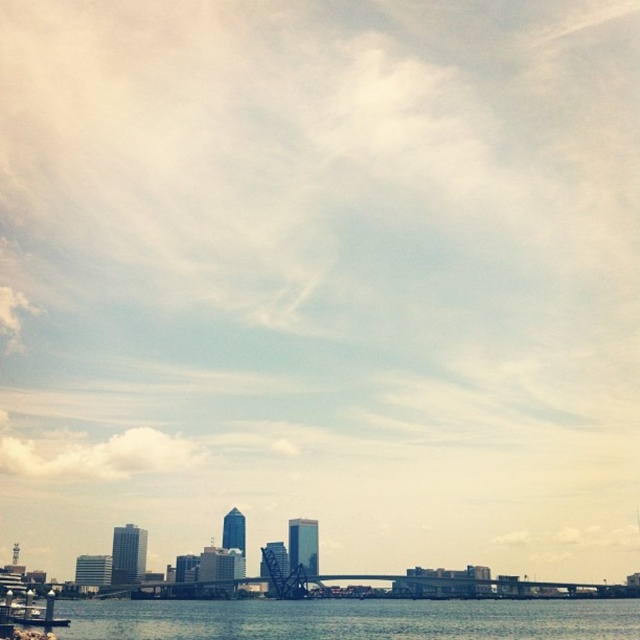
Question: From the image, what is the correct spatial relationship of clear water at lower center in relation to metallic gray boat at lower left?

Choices:
 (A) above
 (B) below

Answer: (B)

Question: Which point is farther from the camera taking this photo?

Choices:
 (A) (26, 600)
 (B) (125, 602)

Answer: (B)

Question: Which point is farther to the camera?

Choices:
 (A) (636, 637)
 (B) (10, 592)

Answer: (B)

Question: Does clear water at lower center appear over metallic gray boat at lower left?

Choices:
 (A) no
 (B) yes

Answer: (A)

Question: Is clear water at lower center wider than metallic gray boat at lower left?

Choices:
 (A) no
 (B) yes

Answer: (B)